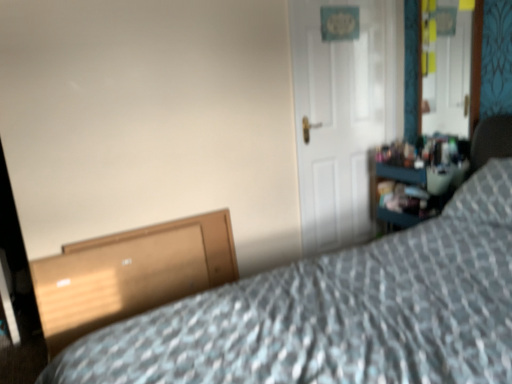
Question: Considering the relative sizes of wooden file cabinet at lower left and white matte door at center in the image provided, is wooden file cabinet at lower left smaller than white matte door at center?

Choices:
 (A) no
 (B) yes

Answer: (B)

Question: Could you tell me if wooden file cabinet at lower left is turned towards white matte door at center?

Choices:
 (A) no
 (B) yes

Answer: (A)

Question: Is wooden file cabinet at lower left directly adjacent to white matte door at center?

Choices:
 (A) yes
 (B) no

Answer: (B)

Question: Does wooden file cabinet at lower left have a lesser height compared to white matte door at center?

Choices:
 (A) yes
 (B) no

Answer: (A)

Question: Is wooden file cabinet at lower left taller than white matte door at center?

Choices:
 (A) no
 (B) yes

Answer: (A)

Question: In terms of height, does wooden dresser at right look taller or shorter compared to metallic mirror at upper right?

Choices:
 (A) short
 (B) tall

Answer: (A)

Question: Based on their sizes in the image, would you say wooden dresser at right is bigger or smaller than metallic mirror at upper right?

Choices:
 (A) big
 (B) small

Answer: (A)

Question: Does point (378, 175) appear closer or farther from the camera than point (471, 0)?

Choices:
 (A) farther
 (B) closer

Answer: (B)

Question: Choose the correct answer: Is wooden dresser at right inside metallic mirror at upper right or outside it?

Choices:
 (A) inside
 (B) outside

Answer: (B)

Question: Considering the positions of patterned fabric bed at lower right and wooden file cabinet at lower left in the image, is patterned fabric bed at lower right taller or shorter than wooden file cabinet at lower left?

Choices:
 (A) tall
 (B) short

Answer: (A)

Question: Considering the positions of point pos(264,339) and point pos(44,321), is point pos(264,339) closer or farther from the camera than point pos(44,321)?

Choices:
 (A) farther
 (B) closer

Answer: (B)

Question: From the image's perspective, is patterned fabric bed at lower right located above or below wooden file cabinet at lower left?

Choices:
 (A) above
 (B) below

Answer: (A)

Question: Relative to wooden file cabinet at lower left, is patterned fabric bed at lower right in front or behind?

Choices:
 (A) front
 (B) behind

Answer: (A)

Question: In the image, is metallic mirror at upper right on the left side or the right side of wooden file cabinet at lower left?

Choices:
 (A) left
 (B) right

Answer: (B)

Question: Does point (440, 8) appear closer or farther from the camera than point (111, 319)?

Choices:
 (A) farther
 (B) closer

Answer: (A)